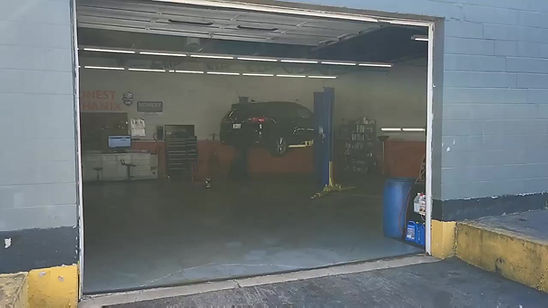
Locate an element on the screen. Image resolution: width=548 pixels, height=308 pixels. ceiling is located at coordinates (390, 46).